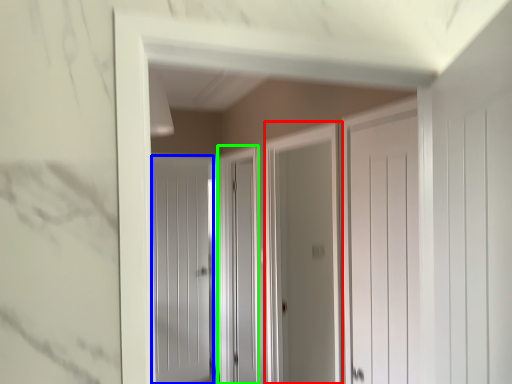
Question: Which object is the farthest from screen door (highlighted by a red box)? Choose among these: door (highlighted by a blue box) or screen door (highlighted by a green box).

Choices:
 (A) door
 (B) screen door

Answer: (A)